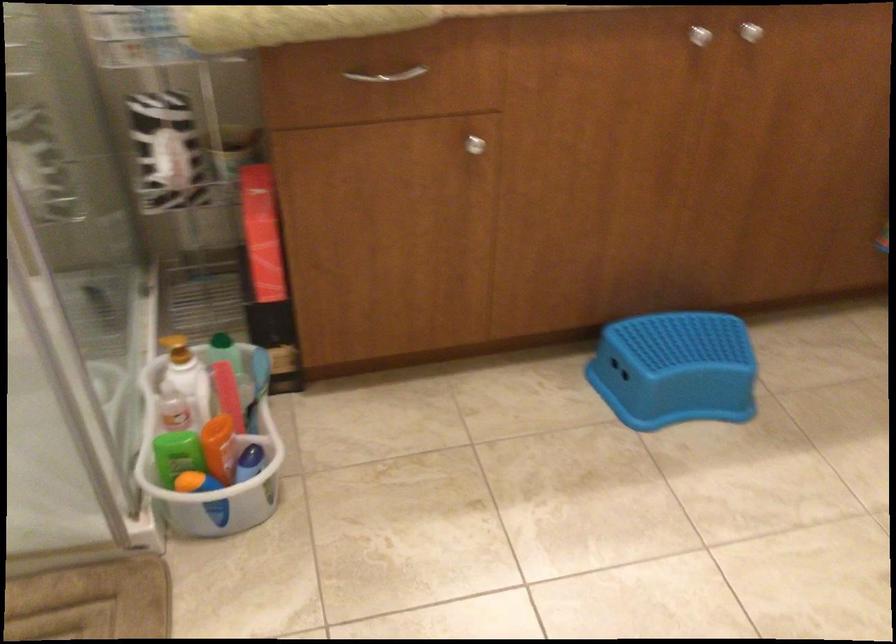
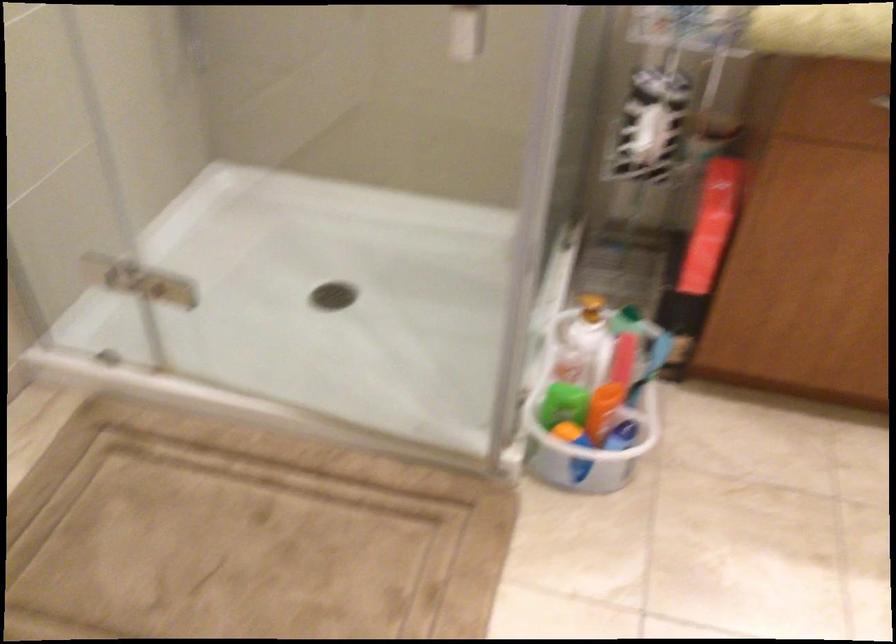
Locate, in the second image, the point that corresponds to (222,431) in the first image.

(610, 393)